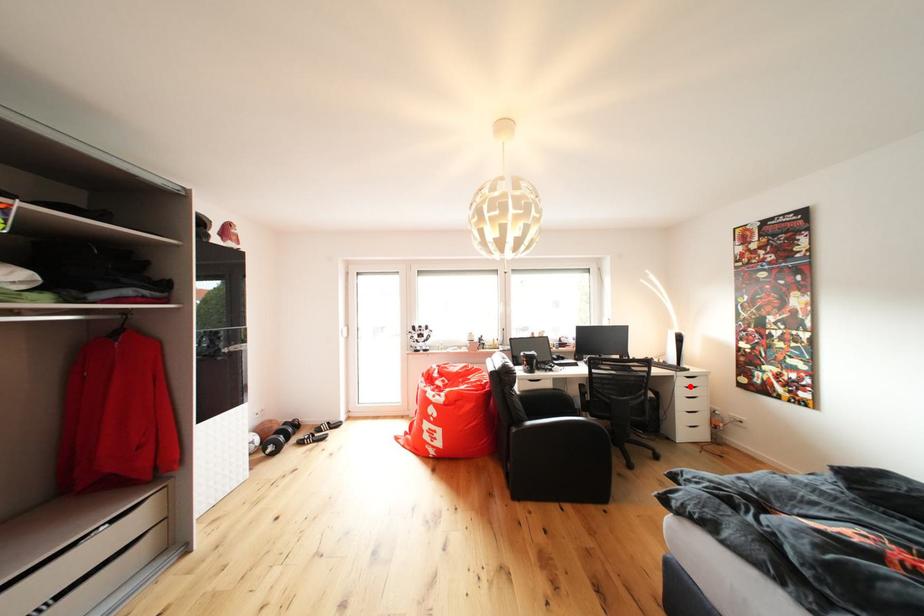
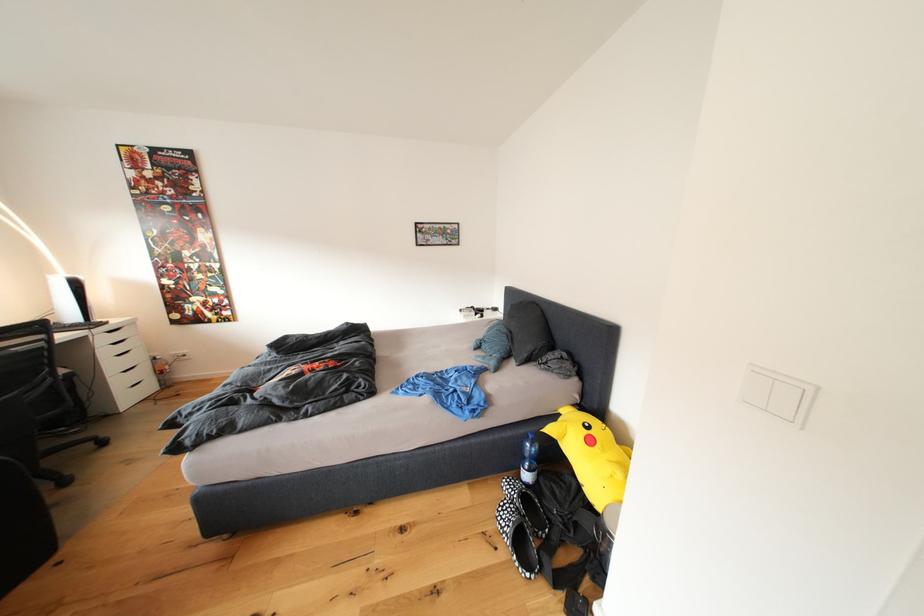
Question: I am providing you with two images of the same scene from different viewpoints. In image1, a red point is highlighted. Considering the same 3D point in image2, which of the following is correct?

Choices:
 (A) It is closer
 (B) It is farther

Answer: (B)